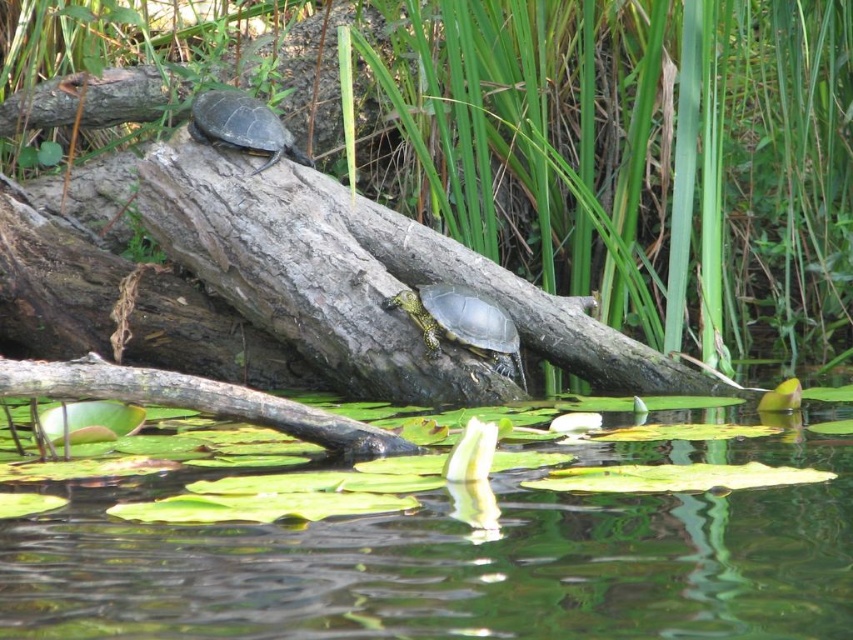
Question: Is shiny green tortoise at center further to the viewer compared to shiny dark green tortoise at upper left?

Choices:
 (A) no
 (B) yes

Answer: (A)

Question: Can you confirm if green leafy water at center is positioned to the right of green leafy vegetation at upper center?

Choices:
 (A) no
 (B) yes

Answer: (A)

Question: Among these points, which one is farthest from the camera?

Choices:
 (A) (219, 97)
 (B) (561, 305)
 (C) (448, 289)

Answer: (B)

Question: Which point is closer to the camera taking this photo?

Choices:
 (A) (440, 282)
 (B) (113, 180)
 (C) (845, 634)

Answer: (C)

Question: Can you confirm if green leafy vegetation at upper center is positioned below shiny green tortoise at center?

Choices:
 (A) no
 (B) yes

Answer: (A)

Question: Which of the following is the closest to the observer?

Choices:
 (A) (445, 323)
 (B) (840, 570)
 (C) (308, 164)

Answer: (B)